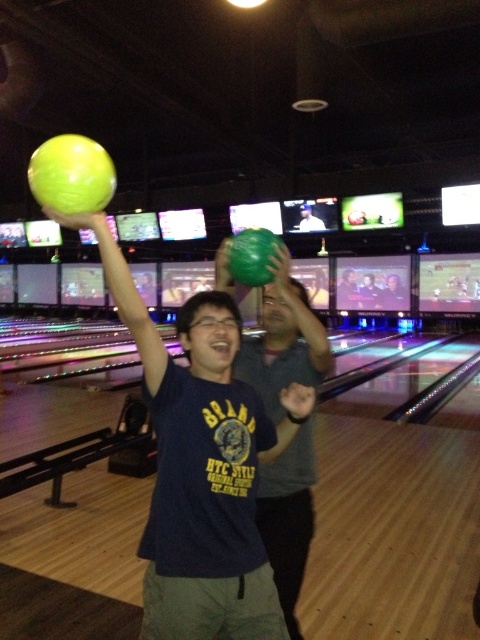
This screenshot has height=640, width=480. What do you see at coordinates (284, 340) in the screenshot?
I see `green rubber bowling ball at upper center` at bounding box center [284, 340].

Is point (286, 557) farther from camera compared to point (48, 208)?

Yes, it is behind point (48, 208).

Where is `green rubber bowling ball at upper center`? green rubber bowling ball at upper center is located at coordinates (284, 340).

What are the coordinates of `green rubber bowling ball at upper center` in the screenshot? It's located at (284, 340).

Locate an element on the screen. Image resolution: width=480 pixels, height=640 pixels. matte green bowling ball at upper center is located at coordinates (202, 467).

Who is taller, matte green bowling ball at upper center or green rubber bowling ball at upper left?

Standing taller between the two is matte green bowling ball at upper center.

This screenshot has height=640, width=480. I want to click on matte green bowling ball at upper center, so click(x=202, y=467).

This screenshot has height=640, width=480. Identify the location of matte green bowling ball at upper center. (202, 467).

Between green rubber bowling ball at upper left and matte green bowling ball at center, which one has more height?

matte green bowling ball at center is taller.

Which is above, green rubber bowling ball at upper left or matte green bowling ball at center?

matte green bowling ball at center is above.

You are a GUI agent. You are given a task and a screenshot of the screen. Output one action in this format:
    pyautogui.click(x=<x>, y=<y>)
    Task: Click on the green rubber bowling ball at upper left
    The image size is (480, 640).
    Given the screenshot: What is the action you would take?
    pyautogui.click(x=72, y=173)